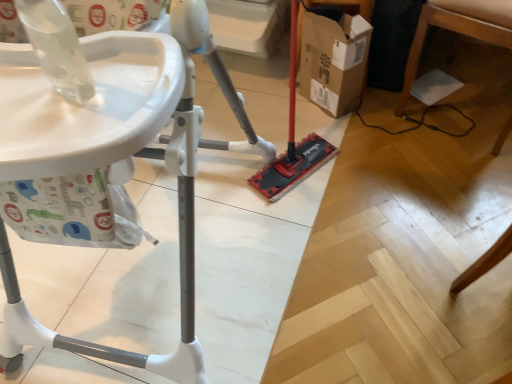
Question: From a real-world perspective, is wooden table leg at lower right, the 1th furniture positioned from the right, physically below white plastic high chair at left, the second furniture positioned from the right?

Choices:
 (A) yes
 (B) no

Answer: (A)

Question: Considering the relative positions of wooden table leg at lower right, which is counted as the 2th furniture, starting from the left, and white plastic high chair at left, which appears as the 1th furniture when viewed from the left, in the image provided, is wooden table leg at lower right, which is counted as the 2th furniture, starting from the left, to the right of white plastic high chair at left, which appears as the 1th furniture when viewed from the left, from the viewer's perspective?

Choices:
 (A) yes
 (B) no

Answer: (A)

Question: Can you confirm if wooden table leg at lower right, which is counted as the 2th furniture, starting from the left, is thinner than white plastic high chair at left, the second furniture positioned from the right?

Choices:
 (A) yes
 (B) no

Answer: (A)

Question: Is wooden table leg at lower right, which is counted as the 2th furniture, starting from the left, aimed at white plastic high chair at left, which appears as the 1th furniture when viewed from the left?

Choices:
 (A) no
 (B) yes

Answer: (A)

Question: Is wooden table leg at lower right, the 1th furniture positioned from the right, outside white plastic high chair at left, which appears as the 1th furniture when viewed from the left?

Choices:
 (A) yes
 (B) no

Answer: (A)

Question: In terms of size, does wooden table leg at lower right, the 1th furniture positioned from the right, appear bigger or smaller than cardboard box at center?

Choices:
 (A) big
 (B) small

Answer: (A)

Question: Is wooden table leg at lower right, which is counted as the 2th furniture, starting from the left, wider or thinner than cardboard box at center?

Choices:
 (A) wide
 (B) thin

Answer: (A)

Question: Would you say wooden table leg at lower right, the 1th furniture positioned from the right, is to the left or to the right of cardboard box at center in the picture?

Choices:
 (A) left
 (B) right

Answer: (B)

Question: Which is correct: wooden table leg at lower right, which is counted as the 2th furniture, starting from the left, is inside cardboard box at center, or outside of it?

Choices:
 (A) outside
 (B) inside

Answer: (A)

Question: From a real-world perspective, is white plastic high chair at left, the second furniture positioned from the right, positioned above or below wooden table leg at lower right, the 1th furniture positioned from the right?

Choices:
 (A) above
 (B) below

Answer: (A)

Question: Is white plastic high chair at left, which appears as the 1th furniture when viewed from the left, inside or outside of wooden table leg at lower right, which is counted as the 2th furniture, starting from the left?

Choices:
 (A) inside
 (B) outside

Answer: (B)

Question: Considering the positions of white plastic high chair at left, the second furniture positioned from the right, and wooden table leg at lower right, the 1th furniture positioned from the right, in the image, is white plastic high chair at left, the second furniture positioned from the right, wider or thinner than wooden table leg at lower right, the 1th furniture positioned from the right,?

Choices:
 (A) wide
 (B) thin

Answer: (A)

Question: From the image's perspective, is white plastic high chair at left, the second furniture positioned from the right, positioned above or below wooden table leg at lower right, which is counted as the 2th furniture, starting from the left?

Choices:
 (A) below
 (B) above

Answer: (A)

Question: Is point click(x=41, y=165) positioned closer to the camera than point click(x=345, y=33)?

Choices:
 (A) closer
 (B) farther

Answer: (A)

Question: From the image's perspective, relative to cardboard box at center, is white plastic high chair at left, the second furniture positioned from the right, above or below?

Choices:
 (A) above
 (B) below

Answer: (B)